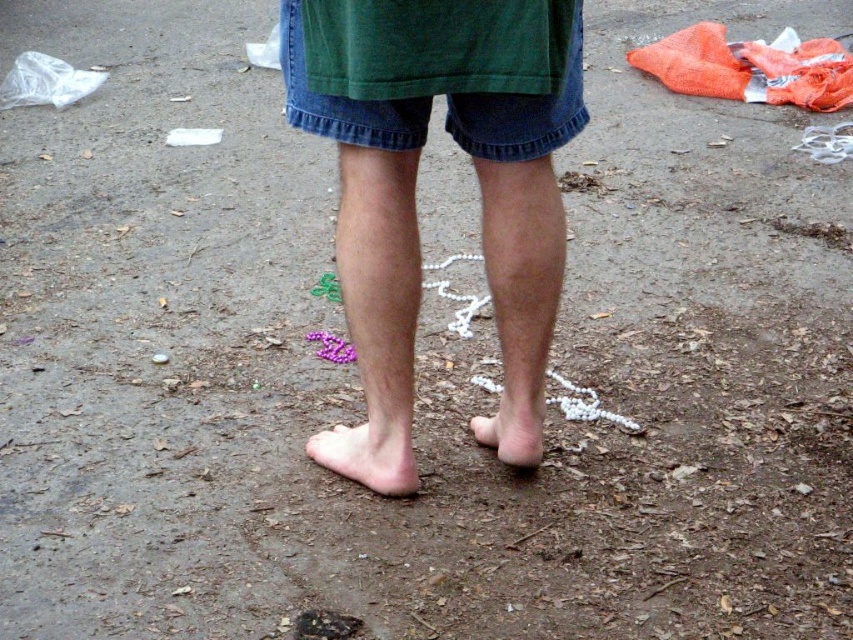
Question: Is smooth skin legs at center behind denim shorts at center?

Choices:
 (A) yes
 (B) no

Answer: (B)

Question: Which of the following is the closest to the observer?

Choices:
 (A) pink matte foot at lower center
 (B) pale skin at lower center
 (C) pink matte toe at lower center

Answer: (B)

Question: Does pale skin at lower center have a larger size compared to pink matte toe at lower center?

Choices:
 (A) yes
 (B) no

Answer: (A)

Question: Which point is closer to the camera?

Choices:
 (A) pink matte foot at lower center
 (B) pale skin at lower center

Answer: (B)

Question: Is denim shorts at center positioned in front of pink matte toe at lower center?

Choices:
 (A) no
 (B) yes

Answer: (B)

Question: Which point is closer to the camera taking this photo?

Choices:
 (A) (393, 292)
 (B) (366, 484)
 (C) (492, 422)
 (D) (486, 436)

Answer: (A)